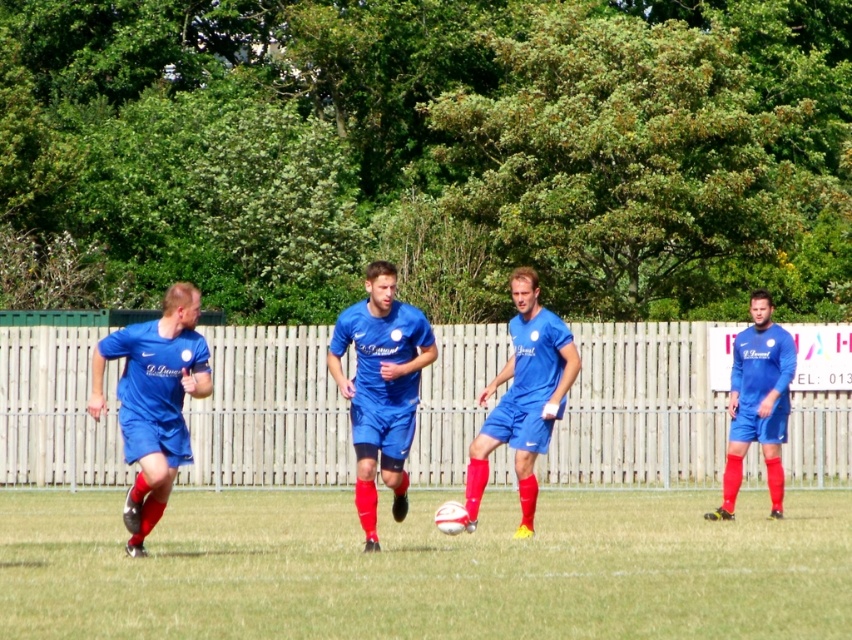
Question: Can you confirm if matte blue shorts at left is positioned to the right of matte blue shorts at center?

Choices:
 (A) no
 (B) yes

Answer: (A)

Question: Which of the following is the farthest from the observer?

Choices:
 (A) (540, 310)
 (B) (91, 381)

Answer: (B)

Question: Is blue matte soccer player at center to the left of matte blue shorts at center from the viewer's perspective?

Choices:
 (A) yes
 (B) no

Answer: (A)

Question: Is blue fabric soccer team at center to the right of matte blue shorts at center from the viewer's perspective?

Choices:
 (A) no
 (B) yes

Answer: (A)

Question: Which point is closer to the camera?

Choices:
 (A) (625, 531)
 (B) (167, 298)

Answer: (B)

Question: Which of the following is the closest to the observer?

Choices:
 (A) blue fabric soccer team at center
 (B) blue matte soccer player at center
 (C) matte blue shorts at center

Answer: (A)